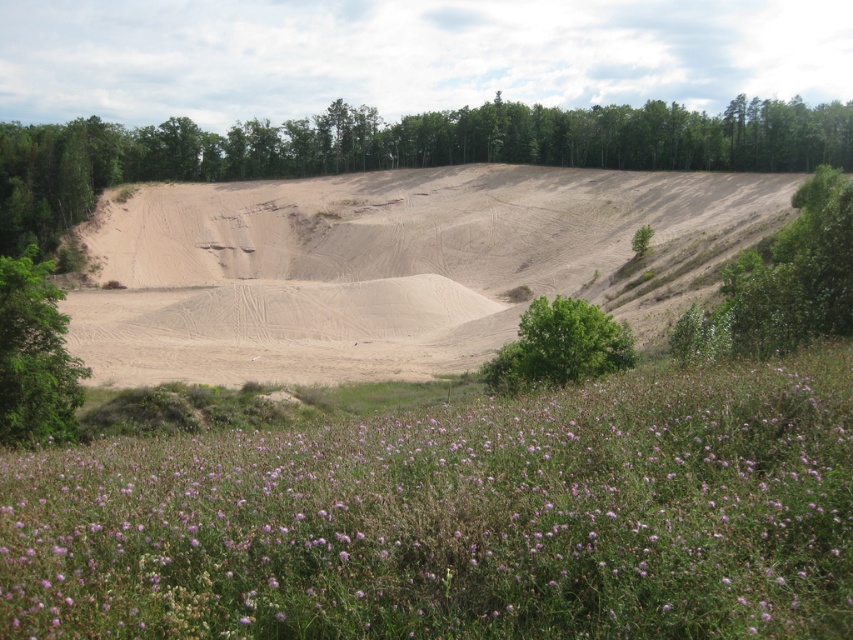
Does green leafy tree at upper center come in front of green leafy tree at right?

That is False.

Can you confirm if green leafy tree at upper center is smaller than green leafy tree at right?

Incorrect, green leafy tree at upper center is not smaller in size than green leafy tree at right.

Does point (711, 120) come in front of point (843, 193)?

No, it is not.

The image size is (853, 640). I want to click on green leafy tree at upper center, so tap(397, 148).

Is point (49, 412) farther from viewer compared to point (567, 349)?

No.

You are a GUI agent. You are given a task and a screenshot of the screen. Output one action in this format:
    pyautogui.click(x=<x>, y=<y>)
    Task: Click on the green leafy tree at left
    
    Given the screenshot: What is the action you would take?
    pyautogui.click(x=33, y=356)

Find the location of a particular element. The width and height of the screenshot is (853, 640). green leafy tree at left is located at coordinates (33, 356).

Does green leafy tree at right have a larger size compared to green leafy tree at left?

Correct, green leafy tree at right is larger in size than green leafy tree at left.

Can you confirm if green leafy tree at right is smaller than green leafy tree at left?

Actually, green leafy tree at right might be larger than green leafy tree at left.

Who is more forward, (701, 355) or (47, 440)?

Point (47, 440)

This screenshot has height=640, width=853. I want to click on green leafy tree at right, so click(x=782, y=282).